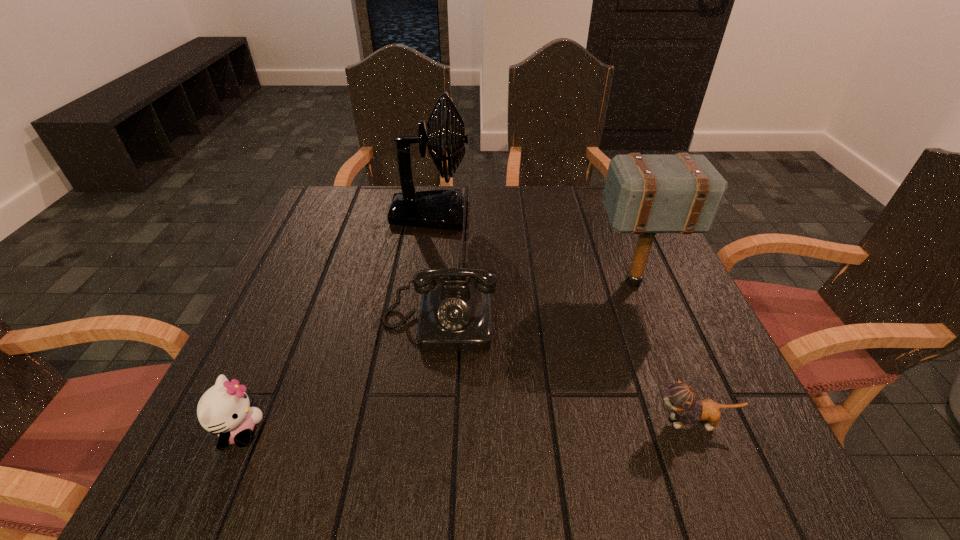
Locate an element on the screen. The image size is (960, 540). fan is located at coordinates point(443,209).

The image size is (960, 540). I want to click on mallet, so click(644, 194).

Image resolution: width=960 pixels, height=540 pixels. I want to click on telephone, so click(x=456, y=316).

This screenshot has width=960, height=540. I want to click on the left kitten, so click(x=224, y=409).

Where is `the right kitten`? The width and height of the screenshot is (960, 540). the right kitten is located at coordinates (681, 397).

At what (x,y) coordinates should I click in order to perform the action: click on free space located in front of the fan to blow air. Please return your answer as a coordinate pair (x, y). Looking at the image, I should click on (541, 214).

Where is `free space located 0.370m on the striking surface of the mallet`? free space located 0.370m on the striking surface of the mallet is located at coordinates (431, 282).

Identify the location of vacant area situated on the striking surface of the mallet. The width and height of the screenshot is (960, 540). (527, 282).

Identify the location of vacant space located 0.230m on the striking surface of the mallet. Image resolution: width=960 pixels, height=540 pixels. (492, 282).

Identify the location of vacant space located 0.180m on the dial of the telephone. (428, 439).